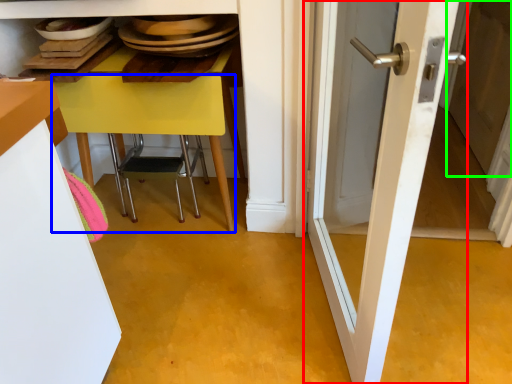
Question: Considering the real-world distances, which object is closest to door (highlighted by a red box)? table (highlighted by a blue box) or screen door (highlighted by a green box).

Choices:
 (A) table
 (B) screen door

Answer: (A)